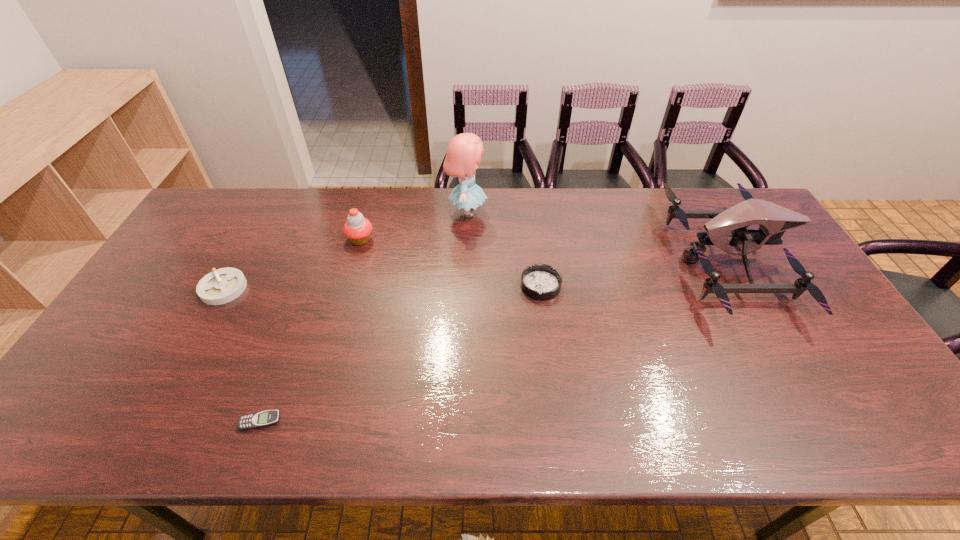
The height and width of the screenshot is (540, 960). I want to click on cupcake that is at the far edge, so click(x=358, y=229).

The image size is (960, 540). I want to click on object present at the near edge, so click(x=266, y=418).

Locate an element on the screen. object that is at the left edge is located at coordinates (223, 285).

The image size is (960, 540). Find the location of `object present at the right edge`. object present at the right edge is located at coordinates (774, 220).

The height and width of the screenshot is (540, 960). I want to click on object positioned at the far right corner, so click(774, 220).

You are a GUI agent. You are given a task and a screenshot of the screen. Output one action in this format:
    pyautogui.click(x=<x>, y=<y>)
    Task: Click on the free space at the far edge of the desktop
    This screenshot has height=540, width=960.
    Given the screenshot: What is the action you would take?
    pyautogui.click(x=667, y=230)

Locate an element on the screen. The width and height of the screenshot is (960, 540). blank space at the near edge of the desktop is located at coordinates (234, 430).

Find the location of `vacant region at the left edge`. vacant region at the left edge is located at coordinates (122, 341).

Locate an element on the screen. vacant space at the right edge of the desktop is located at coordinates (800, 300).

Identify the location of vacant region at the near left corner of the desktop. (77, 411).